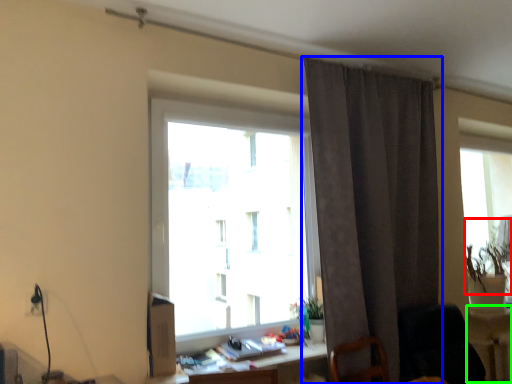
Question: Which object is the closest to the plant (highlighted by a red box)? Choose among these: curtain (highlighted by a blue box) or table (highlighted by a green box).

Choices:
 (A) curtain
 (B) table

Answer: (B)